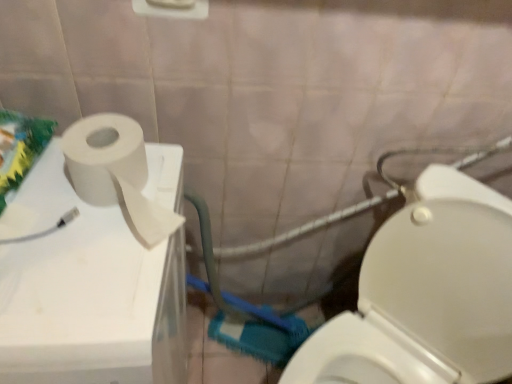
In order to click on white glossy toilet at lower right in this screenshot , I will do `click(426, 295)`.

Describe the element at coordinates (87, 291) in the screenshot. This screenshot has width=512, height=384. I see `white matte toilet paper at upper left` at that location.

I want to click on white glossy toilet at lower right, so click(x=426, y=295).

From a real-world perspective, is white glossy toilet at lower right on top of white matte toilet paper at left?

No.

Locate an element on the screen. The image size is (512, 384). toilet below the white matte toilet paper at left (from the image's perspective) is located at coordinates (426, 295).

Which object is more forward, white glossy toilet at lower right or white matte toilet paper at left?

white glossy toilet at lower right is in front.

Is white glossy toilet at lower right turned away from white matte toilet paper at left?

No.

Is white glossy toilet at lower right at the back of white matte toilet paper at upper left?

No, white matte toilet paper at upper left is not facing the opposite direction of white glossy toilet at lower right.

Can you confirm if white matte toilet paper at upper left is bigger than white glossy toilet at lower right?

Yes.

Which point is more forward, (78, 293) or (459, 198)?

The point (78, 293) is closer to the camera.

Can you see white matte toilet paper at upper left touching white glossy toilet at lower right?

They are not placed beside each other.

Which is behind, point (166, 295) or point (170, 231)?

The point (170, 231) is more distant.

Identify the location of appliance below the white matte toilet paper at left (from the image's perspective). (87, 291).

Would you consider white matte toilet paper at upper left to be distant from white matte toilet paper at left?

No, white matte toilet paper at upper left is not far from white matte toilet paper at left.

Considering the relative sizes of white matte toilet paper at left and white matte toilet paper at upper left in the image provided, is white matte toilet paper at left shorter than white matte toilet paper at upper left?

Yes, white matte toilet paper at left is shorter than white matte toilet paper at upper left.

Find the location of a particular element. Image resolution: width=512 pixels, height=384 pixels. appliance in front of the white matte toilet paper at left is located at coordinates (87, 291).

Which object is thinner, white matte toilet paper at left or white matte toilet paper at upper left?

white matte toilet paper at left is thinner.

Is point (490, 297) positioned before point (126, 217)?

No.

How many degrees apart are the facing directions of white glossy toilet at lower right and white matte toilet paper at upper left?

The angular difference between white glossy toilet at lower right and white matte toilet paper at upper left is 47.8 degrees.

Between white glossy toilet at lower right and white matte toilet paper at upper left, which one has smaller size?

With smaller size is white glossy toilet at lower right.

Is white matte toilet paper at upper left surrounded by white glossy toilet at lower right?

No, white matte toilet paper at upper left is not inside white glossy toilet at lower right.

Between white matte toilet paper at left and white glossy toilet at lower right, which one appears on the left side from the viewer's perspective?

Positioned to the left is white matte toilet paper at left.

Looking at this image, from a real-world perspective, who is located lower, white matte toilet paper at left or white glossy toilet at lower right?

From a 3D spatial view, white glossy toilet at lower right is below.

What's the angular difference between white matte toilet paper at left and white glossy toilet at lower right's facing directions?

white matte toilet paper at left and white glossy toilet at lower right are facing 43.3 degrees away from each other.

Which is farther from the camera, (79,158) or (354,329)?

The point (354,329) is more distant.

You are a GUI agent. You are given a task and a screenshot of the screen. Output one action in this format:
    pyautogui.click(x=<x>, y=<y>)
    Task: Click on the toiletry paper that is on the left side of white glossy toilet at lower right
    The image size is (512, 384).
    Given the screenshot: What is the action you would take?
    (116, 173)

Image resolution: width=512 pixels, height=384 pixels. Find the location of `toilet below the white matte toilet paper at upper left (from a real-world perspective)`. toilet below the white matte toilet paper at upper left (from a real-world perspective) is located at coordinates (426, 295).

When comparing their distances from white matte toilet paper at left, does white matte toilet paper at upper left or white glossy toilet at lower right seem further?

Based on the image, white glossy toilet at lower right appears to be further to white matte toilet paper at left.

Estimate the real-world distances between objects in this image. Which object is further from white matte toilet paper at upper left, white glossy toilet at lower right or white matte toilet paper at left?

Based on the image, white glossy toilet at lower right appears to be further to white matte toilet paper at upper left.

Looking at the image, which one is located closer to white matte toilet paper at left, white glossy toilet at lower right or white matte toilet paper at upper left?

white matte toilet paper at upper left lies closer to white matte toilet paper at left than the other object.

Based on their spatial positions, is white matte toilet paper at left or white glossy toilet at lower right further from white matte toilet paper at upper left?

Based on the image, white glossy toilet at lower right appears to be further to white matte toilet paper at upper left.

Looking at the image, which one is located closer to white glossy toilet at lower right, white matte toilet paper at left or white matte toilet paper at upper left?

The object closer to white glossy toilet at lower right is white matte toilet paper at upper left.

When comparing their distances from white glossy toilet at lower right, does white matte toilet paper at upper left or white matte toilet paper at left seem closer?

white matte toilet paper at upper left.

At what (x,y) coordinates should I click in order to perform the action: click on toiletry paper between white matte toilet paper at upper left and white glossy toilet at lower right from left to right. Please return your answer as a coordinate pair (x, y). The image size is (512, 384). Looking at the image, I should click on (116, 173).